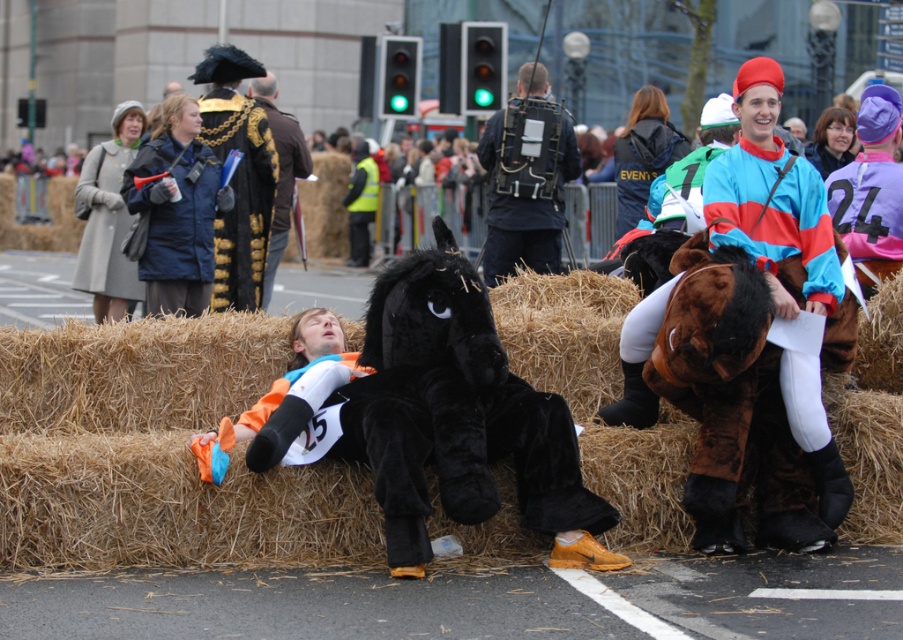
Is point (82, 266) farther from viewer compared to point (273, 106)?

No.

Which of these two, light gray wool coat at upper left or velvet black horse at center, stands taller?

velvet black horse at center is taller.

This screenshot has height=640, width=903. I want to click on light gray wool coat at upper left, so click(x=105, y=225).

This screenshot has width=903, height=640. I want to click on light gray wool coat at upper left, so click(x=105, y=225).

Who is higher up, shiny blue and red jersey at upper right or teal and pink jersey at center?

teal and pink jersey at center

Is shiny blue and red jersey at upper right positioned behind teal and pink jersey at center?

No.

Who is more forward, (624, 337) or (491, 136)?

Point (624, 337) is in front.

Locate an element on the screen. shiny blue and red jersey at upper right is located at coordinates (750, 339).

Which is in front, point (86, 401) or point (727, 186)?

Point (727, 186)

Does brown straw bale at center have a greater height compared to shiny blue and red jersey at upper right?

No.

I want to click on brown straw bale at center, so 157,452.

Identify the location of brown straw bale at center. (157, 452).